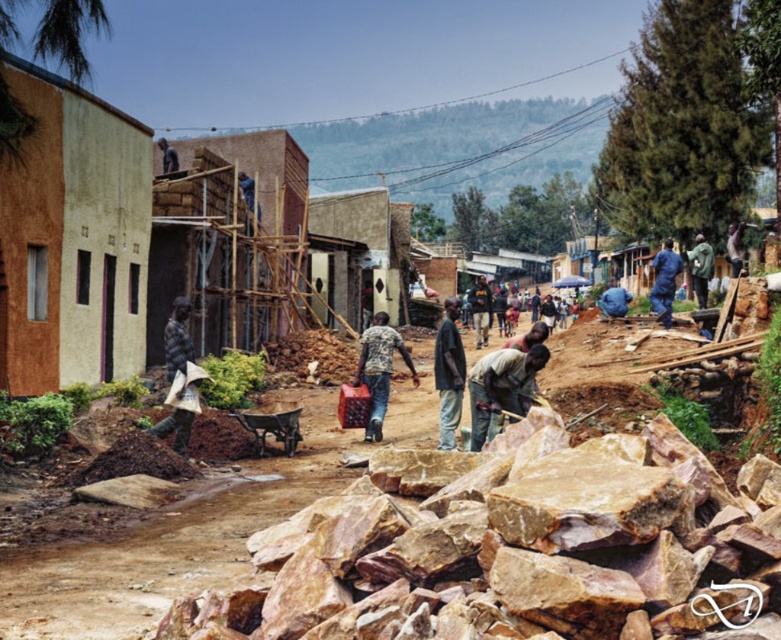
Can you confirm if blue fabric bag at center is positioned below dark brown wooden pole at upper center?

Yes, blue fabric bag at center is below dark brown wooden pole at upper center.

Is blue fabric bag at center wider than dark brown wooden pole at upper center?

Correct, the width of blue fabric bag at center exceeds that of dark brown wooden pole at upper center.

Locate an element on the screen. The height and width of the screenshot is (640, 781). blue fabric bag at center is located at coordinates (612, 300).

Between dark brown leather hammer at center and dark brown wooden pole at upper center, which one appears on the left side from the viewer's perspective?

From the viewer's perspective, dark brown wooden pole at upper center appears more on the left side.

Between dark brown leather hammer at center and dark brown wooden pole at upper center, which one is positioned lower?

Positioned lower is dark brown leather hammer at center.

What do you see at coordinates (501, 388) in the screenshot?
I see `dark brown leather hammer at center` at bounding box center [501, 388].

Locate an element on the screen. This screenshot has height=640, width=781. dark brown leather hammer at center is located at coordinates coord(501,388).

Measure the distance from blue fabric at right to dark brown wooden pole at upper center.

The distance of blue fabric at right from dark brown wooden pole at upper center is 12.88 meters.

Is point (655, 284) less distant than point (173, 160)?

Yes.

Find the location of a particular element. The height and width of the screenshot is (640, 781). blue fabric at right is located at coordinates (664, 282).